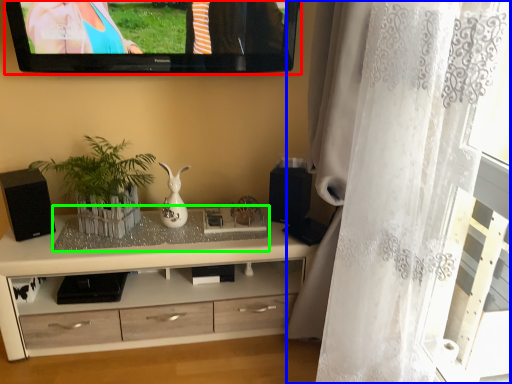
Question: Which is farther away from television (highlighted by a red box)? curtain (highlighted by a blue box) or glass table (highlighted by a green box)?

Choices:
 (A) curtain
 (B) glass table

Answer: (A)